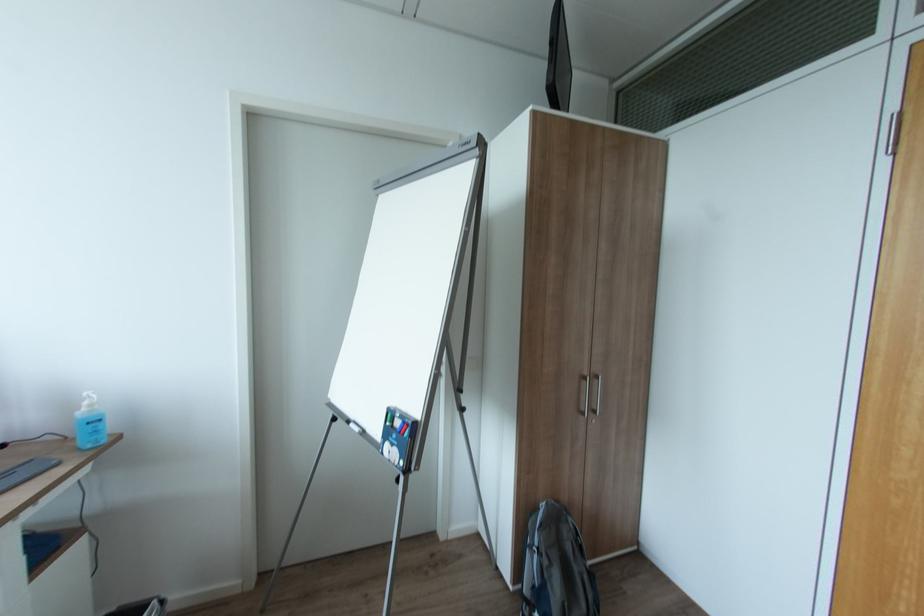
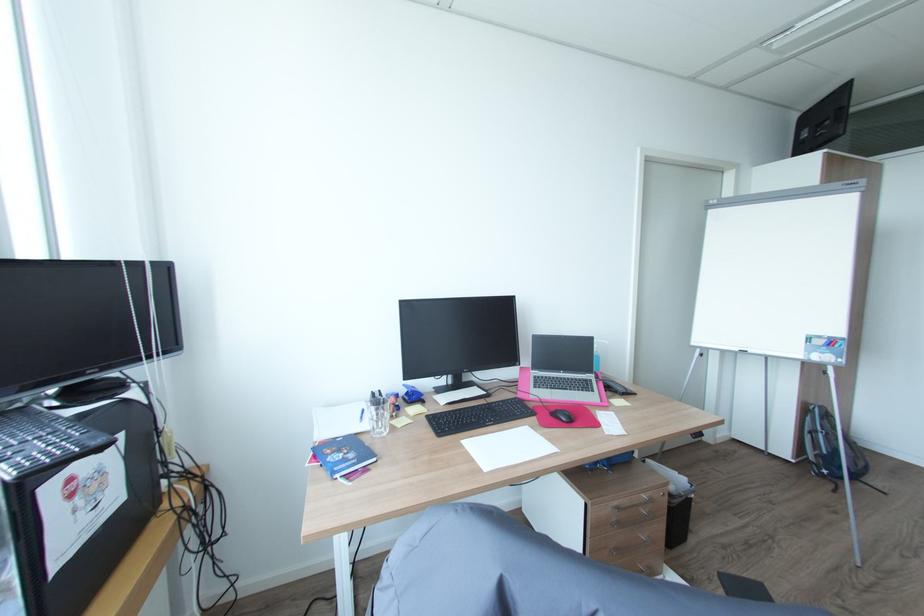
Question: What movement of the cameraman would produce the second image?

Choices:
 (A) Left
 (B) Right
 (C) Forward
 (D) Backward

Answer: (A)